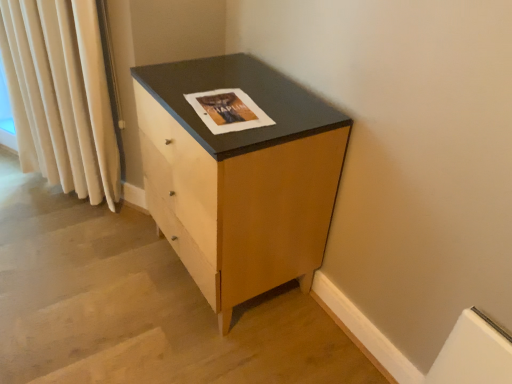
The height and width of the screenshot is (384, 512). What are the coordinates of `vacant space in front of cream velvet curtain at left` in the screenshot? It's located at (69, 241).